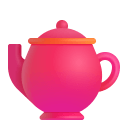
The height and width of the screenshot is (128, 128). In order to click on emptyspace bottom left of tea pot in this screenshot , I will do `click(17, 118)`.